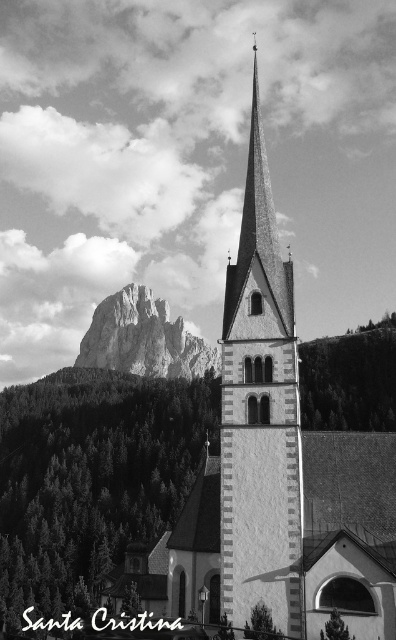
Question: Among these objects, which one is nearest to the camera?

Choices:
 (A) white stone tower at center
 (B) rugged stone mountain at center

Answer: (A)

Question: Is white stone tower at center to the left of rugged stone mountain at center from the viewer's perspective?

Choices:
 (A) no
 (B) yes

Answer: (A)

Question: Which object is farther from the camera taking this photo?

Choices:
 (A) white stone tower at center
 (B) rugged stone mountain at center

Answer: (B)

Question: Does white stone tower at center appear under rugged stone mountain at center?

Choices:
 (A) yes
 (B) no

Answer: (B)

Question: Does white stone tower at center appear over rugged stone mountain at center?

Choices:
 (A) no
 (B) yes

Answer: (B)